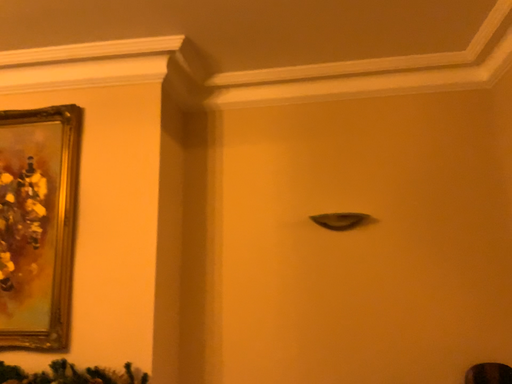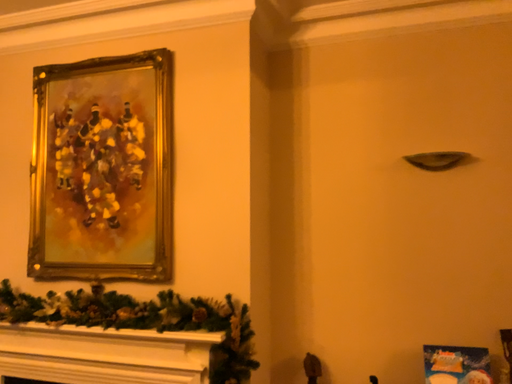
Question: How did the camera likely rotate when shooting the video?

Choices:
 (A) rotated upward
 (B) rotated downward

Answer: (B)